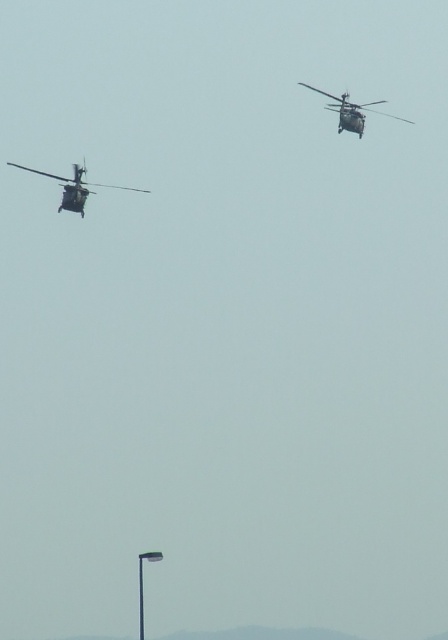
Does metallic gray helicopter at left appear over metallic gray helicopter at upper right?

Incorrect, metallic gray helicopter at left is not positioned above metallic gray helicopter at upper right.

Measure the distance between point (59, 211) and camera.

Point (59, 211) and camera are 345.79 feet apart from each other.

You are a GUI agent. You are given a task and a screenshot of the screen. Output one action in this format:
    pyautogui.click(x=<x>, y=<y>)
    Task: Click on the metallic gray helicopter at left
    
    Given the screenshot: What is the action you would take?
    pyautogui.click(x=74, y=188)